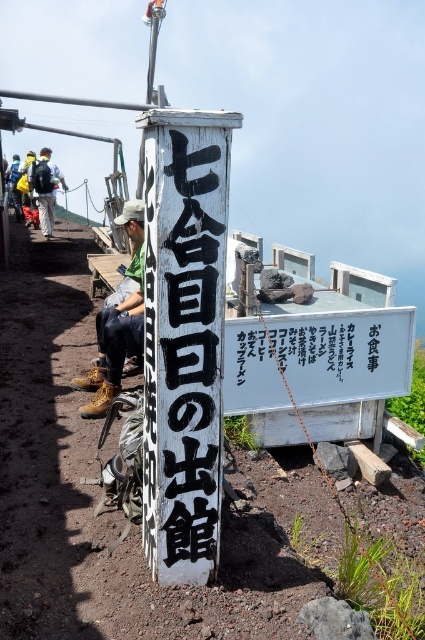
Question: Can you confirm if black painted wood sign at center is thinner than black paper sign at center?

Choices:
 (A) no
 (B) yes

Answer: (B)

Question: In this image, where is black paper sign at center located relative to brown leather boots at center?

Choices:
 (A) left
 (B) right

Answer: (B)

Question: Which of the following is the farthest from the observer?

Choices:
 (A) black painted wood sign at center
 (B) black paper sign at center

Answer: (B)

Question: Which object appears farthest from the camera in this image?

Choices:
 (A) brown leather boots at center
 (B) black painted wood sign at center
 (C) black paper sign at center

Answer: (C)

Question: Which point is closer to the camera?

Choices:
 (A) black paper sign at center
 (B) matte black backpack at left
 (C) brown leather boots at center

Answer: (C)

Question: Can you confirm if black painted wood sign at center is positioned to the right of black paper sign at center?

Choices:
 (A) no
 (B) yes

Answer: (A)